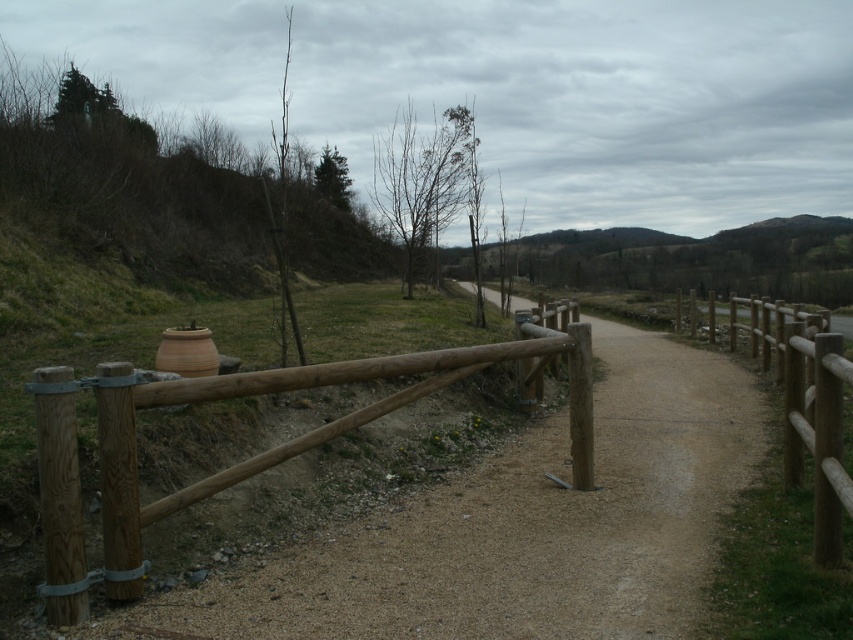
Is brown wooden fence at center-left taller than brown wooden fence at right?

No.

Does point (74, 506) come farther from viewer compared to point (784, 472)?

No.

Where is `brown wooden fence at center-left`? The height and width of the screenshot is (640, 853). brown wooden fence at center-left is located at coordinates (242, 460).